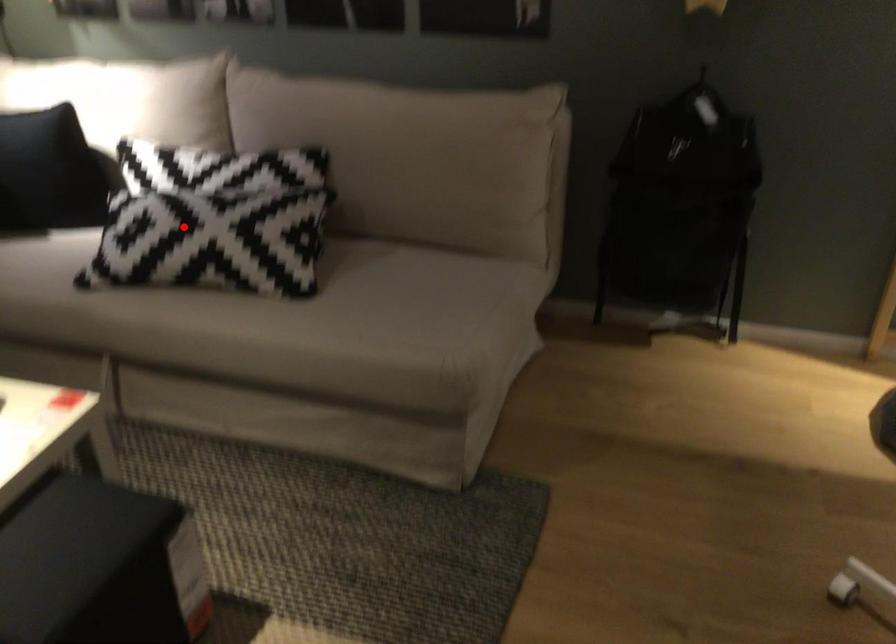
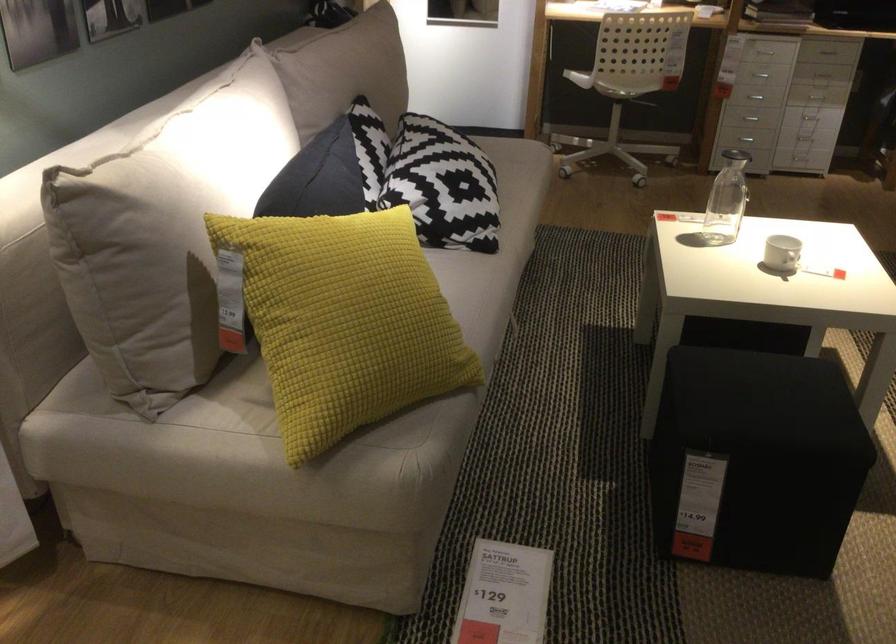
In the second image, find the point that corresponds to the highlighted location in the first image.

(442, 185)